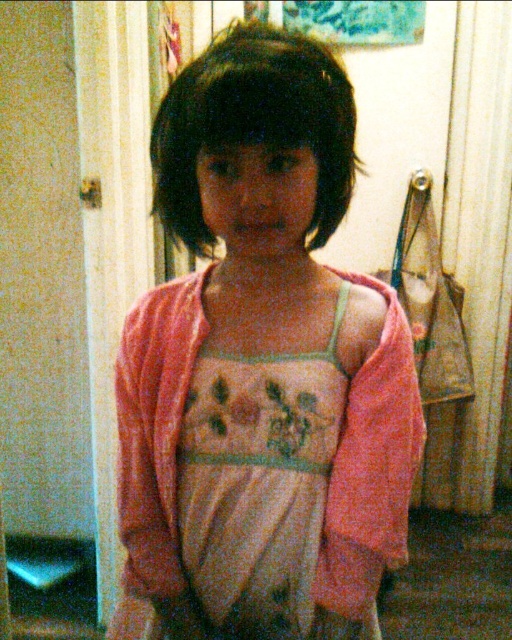
Question: Which is farther from the pink soft fabric dress at center?

Choices:
 (A) dark matte hair at center
 (B) light pink fabric dress at center

Answer: (A)

Question: Can you confirm if pink soft fabric dress at center is positioned above dark matte hair at center?

Choices:
 (A) yes
 (B) no

Answer: (B)

Question: Which object appears farthest from the camera in this image?

Choices:
 (A) pink soft fabric dress at center
 (B) light pink fabric dress at center
 (C) dark matte hair at center

Answer: (B)

Question: Does pink soft fabric dress at center appear on the left side of light pink fabric dress at center?

Choices:
 (A) no
 (B) yes

Answer: (B)

Question: Based on their relative distances, which object is farther from the light pink fabric dress at center?

Choices:
 (A) dark matte hair at center
 (B) pink soft fabric dress at center

Answer: (A)

Question: Is pink soft fabric dress at center further to the viewer compared to light pink fabric dress at center?

Choices:
 (A) yes
 (B) no

Answer: (B)